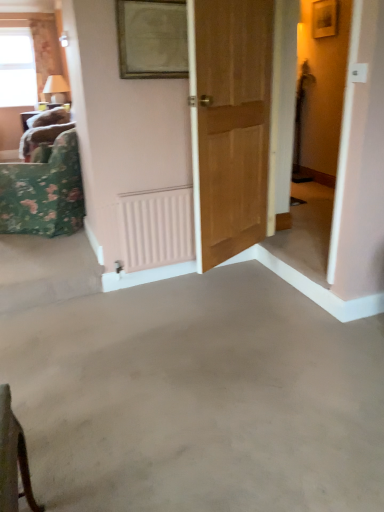
Question: From the image's perspective, is floral fabric curtain at upper left positioned above or below wooden door at center?

Choices:
 (A) above
 (B) below

Answer: (A)

Question: Is floral fabric curtain at upper left inside or outside of wooden door at center?

Choices:
 (A) inside
 (B) outside

Answer: (B)

Question: Based on their relative distances, which object is nearer to the clear glass window at upper left?

Choices:
 (A) wooden door at center
 (B) floral fabric curtain at upper left
 (C) pink matte radiator at center
 (D) gray concrete floor at center
 (E) floral fabric cushion at left

Answer: (B)

Question: Estimate the real-world distances between objects in this image. Which object is farther from the floral fabric cushion at left?

Choices:
 (A) clear glass window at upper left
 (B) floral fabric curtain at upper left
 (C) wooden door at center
 (D) pink matte radiator at center
 (E) gray concrete floor at center

Answer: (B)